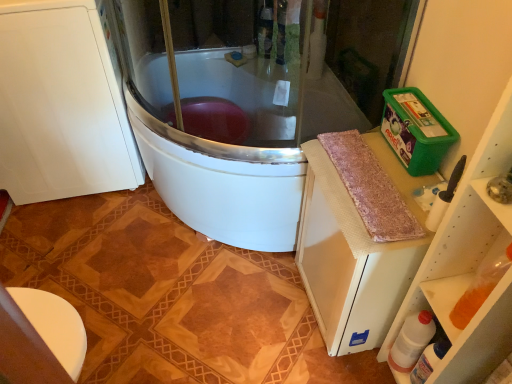
Question: Could you tell me if white plastic bottle at lower right, the first bottle positioned from the right, is turned towards green plastic container at upper right?

Choices:
 (A) no
 (B) yes

Answer: (A)

Question: From a real-world perspective, is white plastic bottle at lower right, the first bottle positioned from the right, located higher than green plastic container at upper right?

Choices:
 (A) yes
 (B) no

Answer: (B)

Question: Does white plastic bottle at lower right, placed as the 2th bottle when sorted from left to right, come in front of green plastic container at upper right?

Choices:
 (A) yes
 (B) no

Answer: (B)

Question: Can we say white plastic bottle at lower right, the first bottle positioned from the right, lies outside green plastic container at upper right?

Choices:
 (A) no
 (B) yes

Answer: (B)

Question: Is white plastic bottle at lower right, the first bottle positioned from the right, positioned behind green plastic container at upper right?

Choices:
 (A) no
 (B) yes

Answer: (B)

Question: From a real-world perspective, relative to pink shaggy rug at right, is white matte cabinet at left vertically above or below?

Choices:
 (A) above
 (B) below

Answer: (B)

Question: Is white matte cabinet at left bigger or smaller than pink shaggy rug at right?

Choices:
 (A) big
 (B) small

Answer: (A)

Question: Is point (64, 144) closer or farther from the camera than point (407, 211)?

Choices:
 (A) closer
 (B) farther

Answer: (B)

Question: From the image's perspective, is white matte cabinet at left positioned above or below pink shaggy rug at right?

Choices:
 (A) below
 (B) above

Answer: (B)

Question: Choose the correct answer: Is green plastic container at upper right inside pink shaggy rug at right or outside it?

Choices:
 (A) inside
 (B) outside

Answer: (B)

Question: Looking at the image, does green plastic container at upper right seem bigger or smaller compared to pink shaggy rug at right?

Choices:
 (A) small
 (B) big

Answer: (B)

Question: Considering the positions of green plastic container at upper right and pink shaggy rug at right in the image, is green plastic container at upper right taller or shorter than pink shaggy rug at right?

Choices:
 (A) short
 (B) tall

Answer: (B)

Question: Is green plastic container at upper right in front of or behind pink shaggy rug at right in the image?

Choices:
 (A) behind
 (B) front

Answer: (B)

Question: Based on their sizes in the image, would you say white matte cabinet at left is bigger or smaller than green plastic container at upper right, which is the 2th appliance from front to back?

Choices:
 (A) big
 (B) small

Answer: (A)

Question: From a real-world perspective, is white matte cabinet at left above or below green plastic container at upper right, positioned as the first appliance in back-to-front order?

Choices:
 (A) above
 (B) below

Answer: (B)